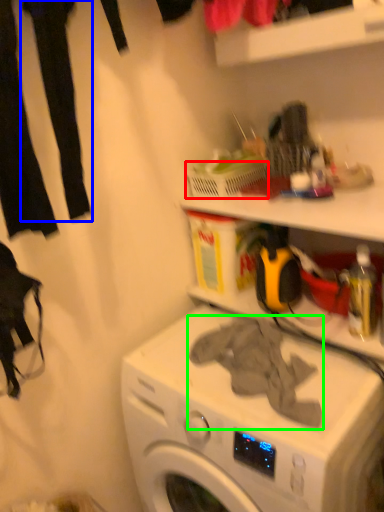
Question: Considering the real-world distances, which object is farthest from basket (highlighted by a red box)? clothing (highlighted by a blue box) or clothing (highlighted by a green box)?

Choices:
 (A) clothing
 (B) clothing

Answer: (A)